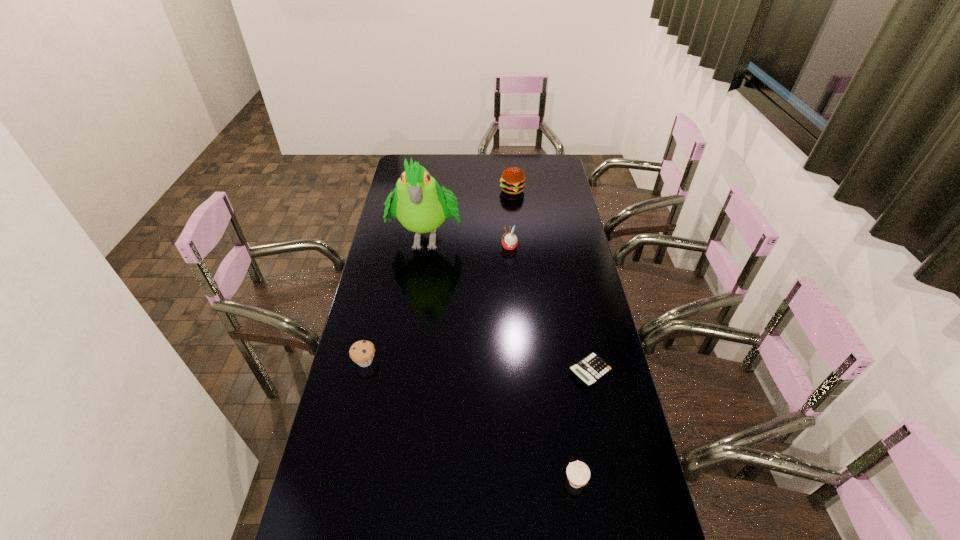
At what (x,y) coordinates should I click in order to perform the action: click on free space at the far edge. Please return your answer as a coordinate pair (x, y). Looking at the image, I should click on (517, 161).

Find the location of a particular element. This screenshot has width=960, height=540. free space at the left edge of the desktop is located at coordinates (394, 280).

The width and height of the screenshot is (960, 540). In order to click on vacant area at the right edge of the desktop in this screenshot , I will do `click(582, 298)`.

Identify the location of free space at the far left corner of the desktop. This screenshot has width=960, height=540. (430, 154).

In the image, there is a desktop. At what (x,y) coordinates should I click in order to perform the action: click on vacant space at the far right corner. Please return your answer as a coordinate pair (x, y). The height and width of the screenshot is (540, 960). Looking at the image, I should click on (554, 171).

Identify the location of free spot between the farthest muffin and the hamburger. Image resolution: width=960 pixels, height=540 pixels. (511, 218).

At what (x,y) coordinates should I click in order to perform the action: click on unoccupied position between the rightmost muffin and the second muffin from left to right. Please return your answer as a coordinate pair (x, y). The width and height of the screenshot is (960, 540). Looking at the image, I should click on (542, 364).

Identify the location of vacant area between the tallest muffin and the calculator. (550, 309).

Image resolution: width=960 pixels, height=540 pixels. I want to click on vacant area that lies between the tallest muffin and the shortest object, so click(x=550, y=309).

You are a GUI agent. You are given a task and a screenshot of the screen. Output one action in this format:
    pyautogui.click(x=<x>, y=<y>)
    Task: Click on the vacant space that is in between the farthest object and the calculator
    The image size is (960, 540).
    Given the screenshot: What is the action you would take?
    pyautogui.click(x=551, y=281)